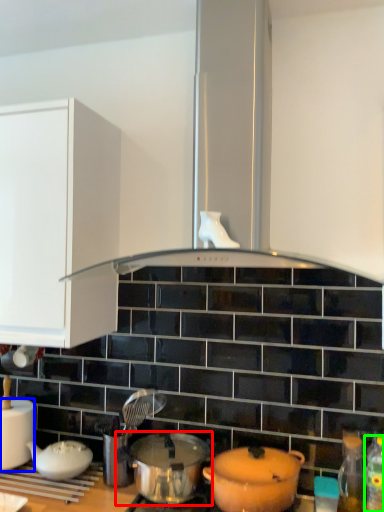
Question: Considering the real-world distances, which object is farthest from pot/pan (highlighted by a red box)? kitchen appliance (highlighted by a blue box) or bottle (highlighted by a green box)?

Choices:
 (A) kitchen appliance
 (B) bottle

Answer: (B)